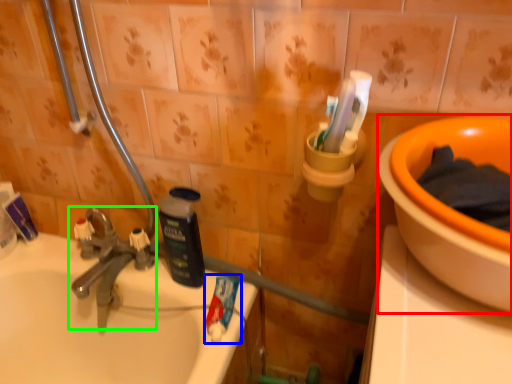
Question: Which object is positioned farthest from basin (highlighted by a red box)? Select from toothpaste (highlighted by a blue box) and tap (highlighted by a green box).

Choices:
 (A) toothpaste
 (B) tap

Answer: (B)